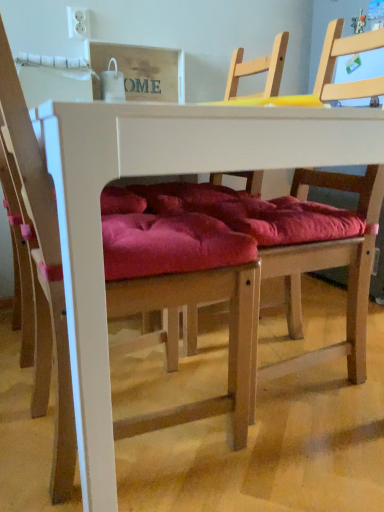
Question: From a real-world perspective, is velvet red cushion at center, placed as the 2th chair when sorted from right to left, physically located above or below wooden chair at center, the 2th chair from the left?

Choices:
 (A) below
 (B) above

Answer: (B)

Question: From their relative heights in the image, would you say velvet red cushion at center, the first chair positioned from the left, is taller or shorter than wooden chair at center, the 2th chair from the left?

Choices:
 (A) short
 (B) tall

Answer: (A)

Question: Which object is positioned farthest from the white matte table at center?

Choices:
 (A) velvet red cushion at center, the first chair positioned from the left
 (B) wooden chair at center, the 2th chair from the left

Answer: (B)

Question: Which of these objects is positioned farthest from the velvet red cushion at center, the first chair positioned from the left?

Choices:
 (A) white matte table at center
 (B) wooden chair at center, placed as the first chair when sorted from right to left

Answer: (B)